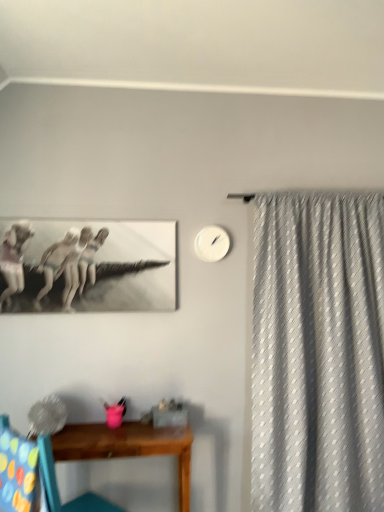
Question: From a real-world perspective, is wooden chair at lower left physically above wooden table at lower center?

Choices:
 (A) yes
 (B) no

Answer: (A)

Question: Considering the relative sizes of wooden chair at lower left and wooden table at lower center in the image provided, is wooden chair at lower left shorter than wooden table at lower center?

Choices:
 (A) no
 (B) yes

Answer: (A)

Question: Would you consider wooden chair at lower left to be distant from wooden table at lower center?

Choices:
 (A) yes
 (B) no

Answer: (B)

Question: Is wooden chair at lower left facing towards wooden table at lower center?

Choices:
 (A) no
 (B) yes

Answer: (B)

Question: Can you confirm if wooden chair at lower left is taller than wooden table at lower center?

Choices:
 (A) no
 (B) yes

Answer: (B)

Question: Is white textured curtain at right inside or outside of multicolored fabric swivel chair at lower left?

Choices:
 (A) outside
 (B) inside

Answer: (A)

Question: From a real-world perspective, is white textured curtain at right positioned above or below multicolored fabric swivel chair at lower left?

Choices:
 (A) below
 (B) above

Answer: (B)

Question: Is white textured curtain at right wider or thinner than multicolored fabric swivel chair at lower left?

Choices:
 (A) thin
 (B) wide

Answer: (B)

Question: Considering the relative positions of white textured curtain at right and multicolored fabric swivel chair at lower left in the image provided, is white textured curtain at right to the left or to the right of multicolored fabric swivel chair at lower left?

Choices:
 (A) left
 (B) right

Answer: (B)

Question: In the image, is white textured curtain at right positioned in front of or behind wooden chair at lower left?

Choices:
 (A) front
 (B) behind

Answer: (B)

Question: Is white textured curtain at right inside or outside of wooden chair at lower left?

Choices:
 (A) inside
 (B) outside

Answer: (B)

Question: From the image's perspective, is white textured curtain at right above or below wooden chair at lower left?

Choices:
 (A) below
 (B) above

Answer: (B)

Question: Does point (354, 269) appear closer or farther from the camera than point (41, 452)?

Choices:
 (A) closer
 (B) farther

Answer: (B)

Question: Considering the positions of wooden chair at lower left and multicolored fabric swivel chair at lower left in the image, is wooden chair at lower left taller or shorter than multicolored fabric swivel chair at lower left?

Choices:
 (A) tall
 (B) short

Answer: (A)

Question: Does point (117, 510) appear closer or farther from the camera than point (23, 495)?

Choices:
 (A) farther
 (B) closer

Answer: (A)